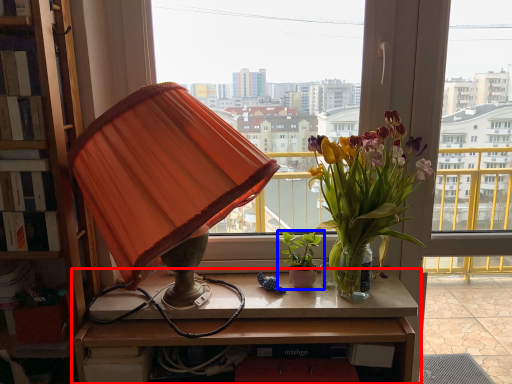
Question: Which of the following is the farthest to the observer, table (highlighted by a red box) or houseplant (highlighted by a blue box)?

Choices:
 (A) table
 (B) houseplant

Answer: (B)